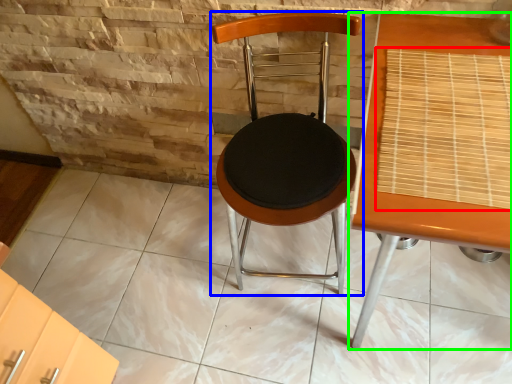
Question: Considering the real-world distances, which object is farthest from mat (highlighted by a red box)? chair (highlighted by a blue box) or table (highlighted by a green box)?

Choices:
 (A) chair
 (B) table

Answer: (A)